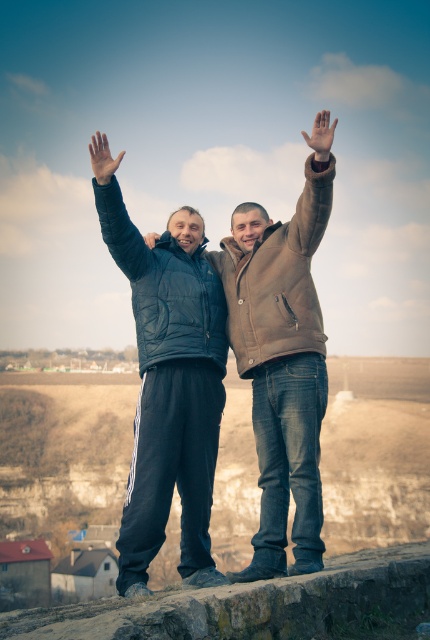
Question: Does matte black jacket at upper left appear on the right side of matte black hand at upper center?

Choices:
 (A) yes
 (B) no

Answer: (A)

Question: Is matte black jacket at upper left wider than brown leather jacket at upper center?

Choices:
 (A) yes
 (B) no

Answer: (A)

Question: Where is matte black jacket at center located in relation to matte black hand at upper center in the image?

Choices:
 (A) right
 (B) left

Answer: (A)

Question: Which of the following is the farthest from the observer?

Choices:
 (A) (334, 160)
 (B) (119, 205)
 (C) (143, 570)

Answer: (B)

Question: Which object is farther from the camera taking this photo?

Choices:
 (A) matte black hand at upper center
 (B) matte black jacket at upper left
 (C) matte black jacket at center

Answer: (A)

Question: Which object appears farthest from the camera in this image?

Choices:
 (A) matte black jacket at upper left
 (B) matte black hand at upper center

Answer: (B)